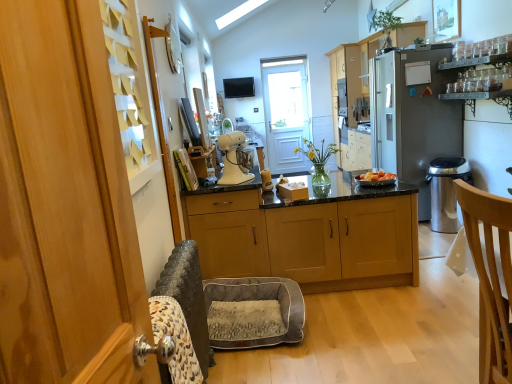
Locate an element on the screen. free spot in front of wooden cabinets at center, which appears as the 1th cabinetry when viewed from the front is located at coordinates point(369,328).